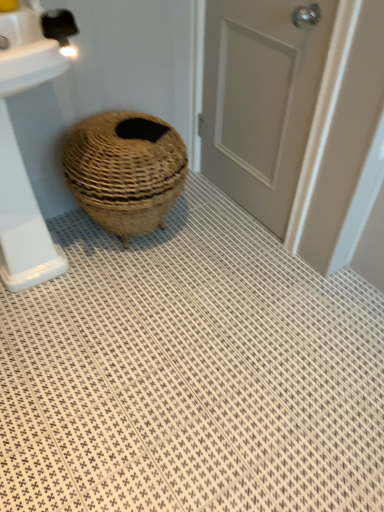
Where is `free point above natural woven basket at center (from a real-world perspective)`? free point above natural woven basket at center (from a real-world perspective) is located at coordinates (115, 132).